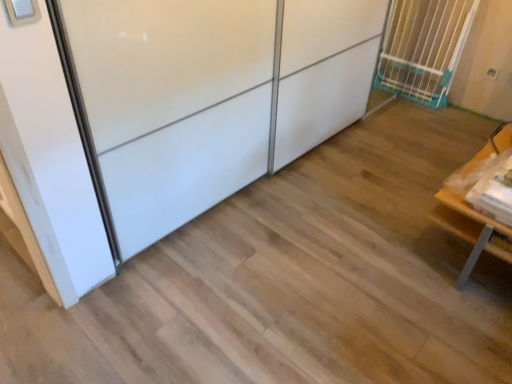
The width and height of the screenshot is (512, 384). In order to click on vacant space underneath white plastic gate at upper right (from a real-world perspective) in this screenshot , I will do `click(413, 95)`.